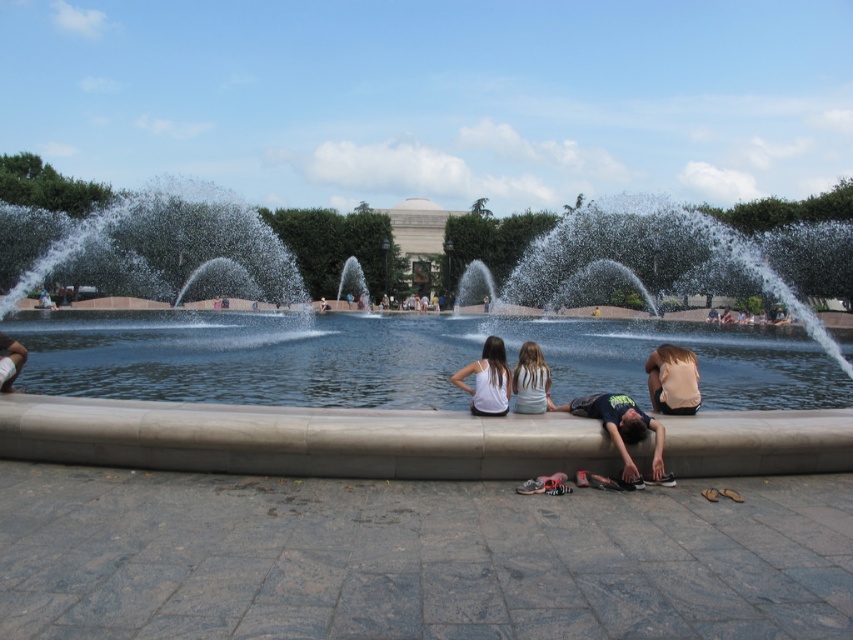
You are a photographer standing at the edge of the fountain. You want to capture a photo of the clear glass water at center and the white tank top at center. Which object is wider in the scene?

The clear glass water at center might be wider than the white tank top at center according to the description.

You are a photographer standing at the edge of the fountain. You want to capture a photo that includes both the clear glass water at center and the light brown fabric shirt at lower right. Which object should you position closer to the left side of your camera frame?

The clear glass water at center should be positioned closer to the left side of your camera frame because it is already on the left side of the light brown fabric shirt at lower right.

You are standing at the edge of the fountain and see the clear water at center and the light brown fabric shirt at lower right. Which object is closer to you?

The clear water at center is closer to you because it is positioned over the light brown fabric shirt at lower right, indicating it is in a higher or more forward spatial plane.